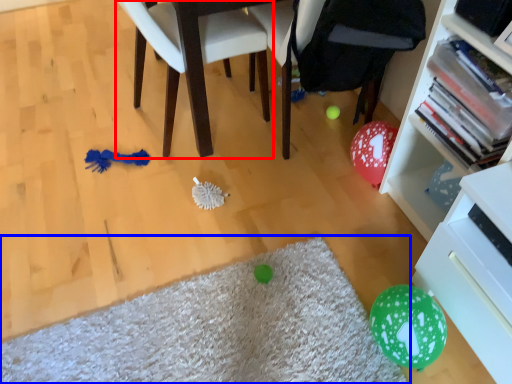
Question: Among these objects, which one is nearest to the camera, chair (highlighted by a red box) or mat (highlighted by a blue box)?

Choices:
 (A) chair
 (B) mat

Answer: (B)